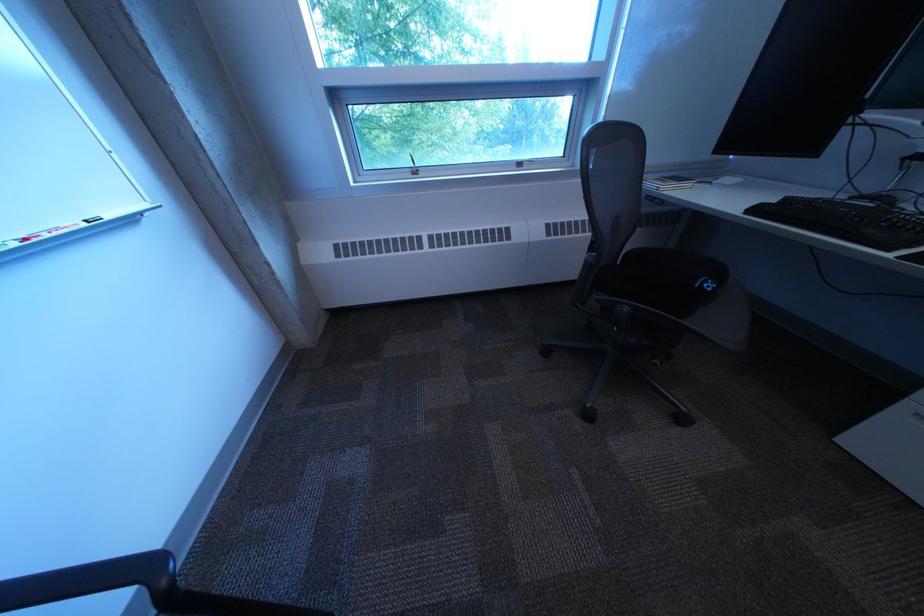
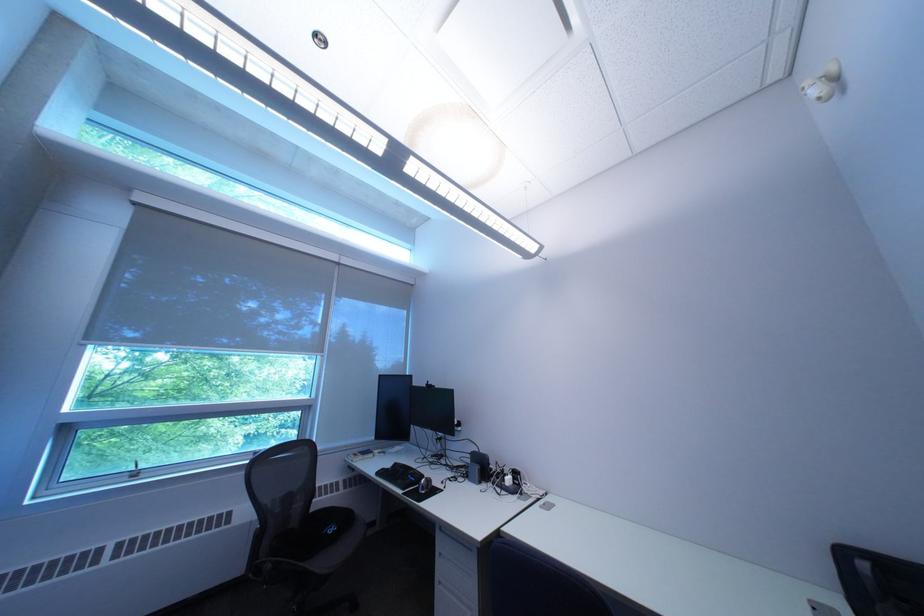
Locate, in the second image, the point that corresponds to (x=767, y=213) in the first image.

(393, 475)